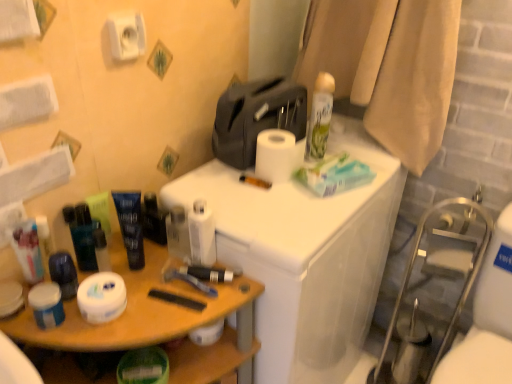
The height and width of the screenshot is (384, 512). Find the location of `vacant space situated above woodenmaterial/texturecounter at left, the 2th counter from the right (from a real-world perspective)`. vacant space situated above woodenmaterial/texturecounter at left, the 2th counter from the right (from a real-world perspective) is located at coordinates tap(143, 302).